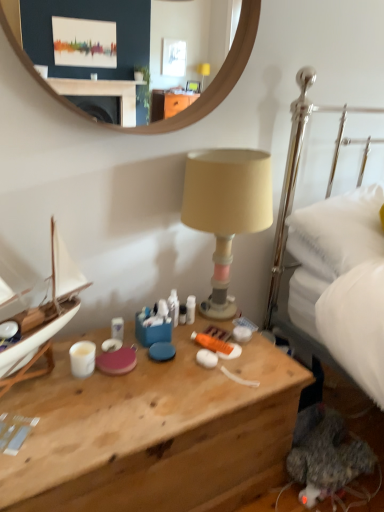
Image resolution: width=384 pixels, height=512 pixels. Find the location of `free location to the right of white plastic tube at center`. free location to the right of white plastic tube at center is located at coordinates (226, 330).